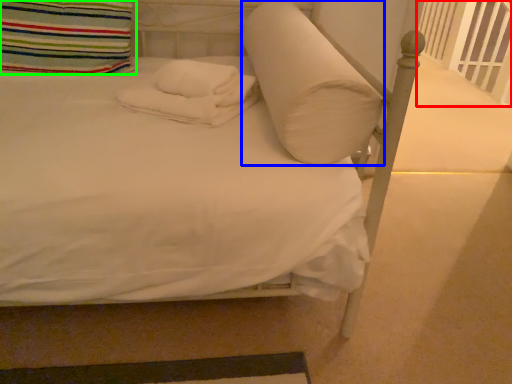
Question: Estimate the real-world distances between objects in this image. Which object is closer to balustrade (highlighted by a red box), pillow (highlighted by a blue box) or pillow (highlighted by a green box)?

Choices:
 (A) pillow
 (B) pillow

Answer: (A)